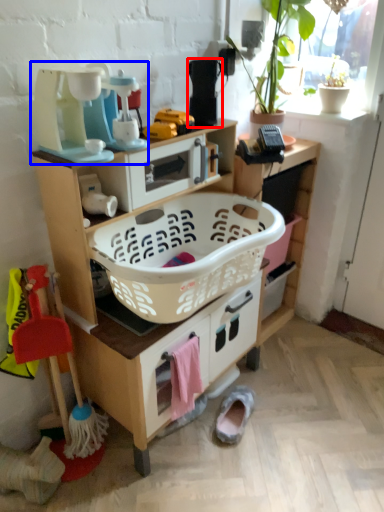
Question: Which point is closer to the camera, appliance (highlighted by a red box) or appliance (highlighted by a blue box)?

Choices:
 (A) appliance
 (B) appliance

Answer: (B)